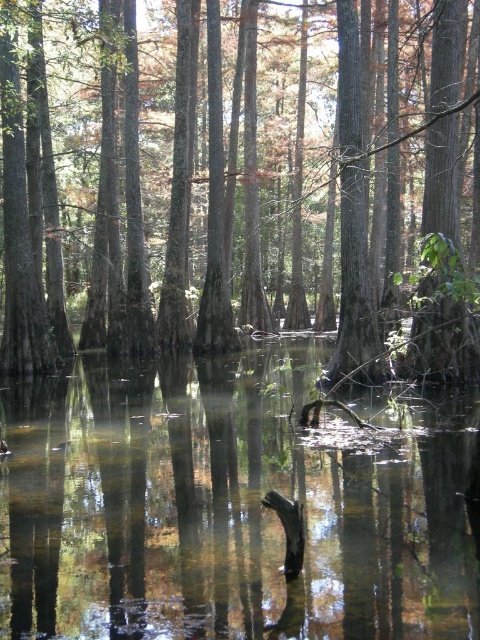
Can you confirm if transparent water at center is wider than smooth brown tree trunk at center?

In fact, transparent water at center might be narrower than smooth brown tree trunk at center.

This screenshot has width=480, height=640. What do you see at coordinates (231, 504) in the screenshot?
I see `transparent water at center` at bounding box center [231, 504].

In order to click on transparent water at center in this screenshot , I will do 231,504.

Find the location of a particular element. The height and width of the screenshot is (640, 480). transparent water at center is located at coordinates (231, 504).